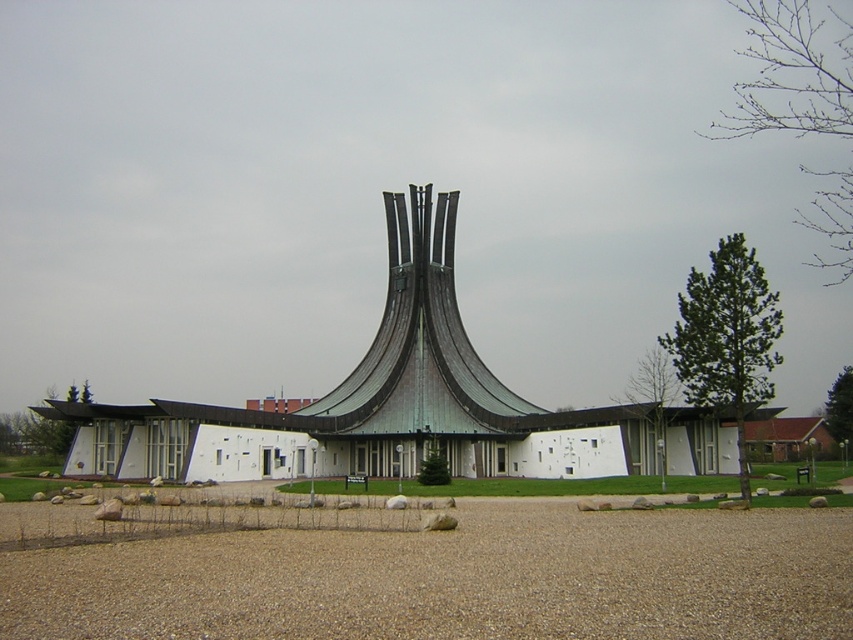
Question: Can you confirm if brown gravel at lower center is positioned below white matte building at center?

Choices:
 (A) no
 (B) yes

Answer: (B)

Question: Can you confirm if brown gravel at lower center is thinner than white matte building at center?

Choices:
 (A) no
 (B) yes

Answer: (B)

Question: Is brown gravel at lower center above white matte building at center?

Choices:
 (A) yes
 (B) no

Answer: (B)

Question: Which of the following is the farthest from the observer?

Choices:
 (A) brown gravel at lower center
 (B) white matte building at center

Answer: (B)